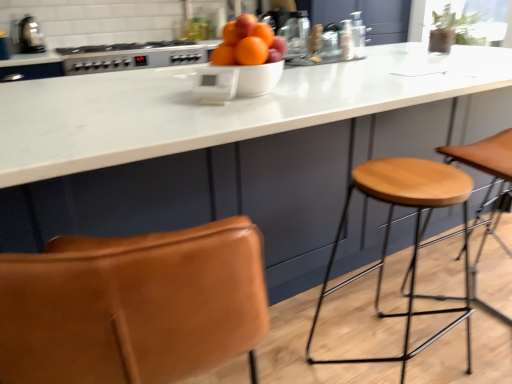
Question: Should I look upward or downward to see light brown wood stool at right?

Choices:
 (A) up
 (B) down

Answer: (B)

Question: From a real-world perspective, is satin silver gas stove at upper center over wooden seat at right?

Choices:
 (A) yes
 (B) no

Answer: (A)

Question: Can you confirm if satin silver gas stove at upper center is smaller than wooden seat at right?

Choices:
 (A) yes
 (B) no

Answer: (A)

Question: Are satin silver gas stove at upper center and wooden seat at right making contact?

Choices:
 (A) no
 (B) yes

Answer: (A)

Question: Considering the relative sizes of satin silver gas stove at upper center and wooden seat at right in the image provided, is satin silver gas stove at upper center taller than wooden seat at right?

Choices:
 (A) no
 (B) yes

Answer: (A)

Question: Could you tell me if satin silver gas stove at upper center is turned towards wooden seat at right?

Choices:
 (A) no
 (B) yes

Answer: (A)

Question: Considering the relative sizes of satin silver gas stove at upper center and wooden seat at right in the image provided, is satin silver gas stove at upper center wider than wooden seat at right?

Choices:
 (A) no
 (B) yes

Answer: (B)

Question: Does white glossy bowl at center have a smaller size compared to metallic silver toaster at upper left, arranged as the 2th appliance when viewed from the front?

Choices:
 (A) no
 (B) yes

Answer: (B)

Question: From the image's perspective, does white glossy bowl at center appear higher than metallic silver toaster at upper left, which is counted as the first appliance, starting from the left?

Choices:
 (A) yes
 (B) no

Answer: (B)

Question: Is white glossy bowl at center facing towards metallic silver toaster at upper left, which is counted as the first appliance, starting from the left?

Choices:
 (A) yes
 (B) no

Answer: (B)

Question: From a real-world perspective, is white glossy bowl at center physically above metallic silver toaster at upper left, the second appliance positioned from the bottom?

Choices:
 (A) yes
 (B) no

Answer: (B)

Question: Considering the relative sizes of white glossy bowl at center and metallic silver toaster at upper left, which is the 1th appliance in top-to-bottom order, in the image provided, is white glossy bowl at center shorter than metallic silver toaster at upper left, which is the 1th appliance in top-to-bottom order,?

Choices:
 (A) no
 (B) yes

Answer: (B)

Question: Is white glossy bowl at center in contact with metallic silver toaster at upper left, which is counted as the first appliance, starting from the left?

Choices:
 (A) yes
 (B) no

Answer: (B)

Question: Is satin silver gas stove at upper center wider than light brown wood stool at right?

Choices:
 (A) no
 (B) yes

Answer: (B)